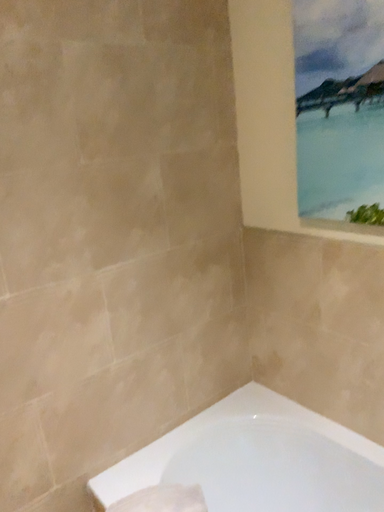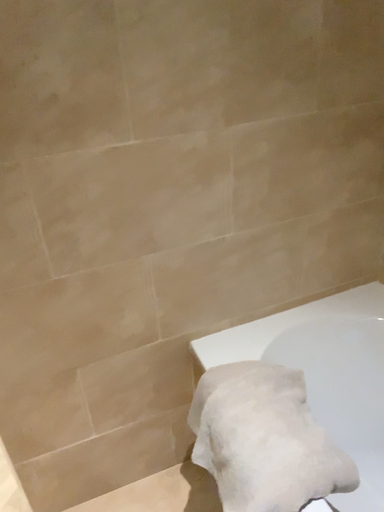
Question: Which way did the camera rotate in the video?

Choices:
 (A) rotated right
 (B) rotated left

Answer: (B)